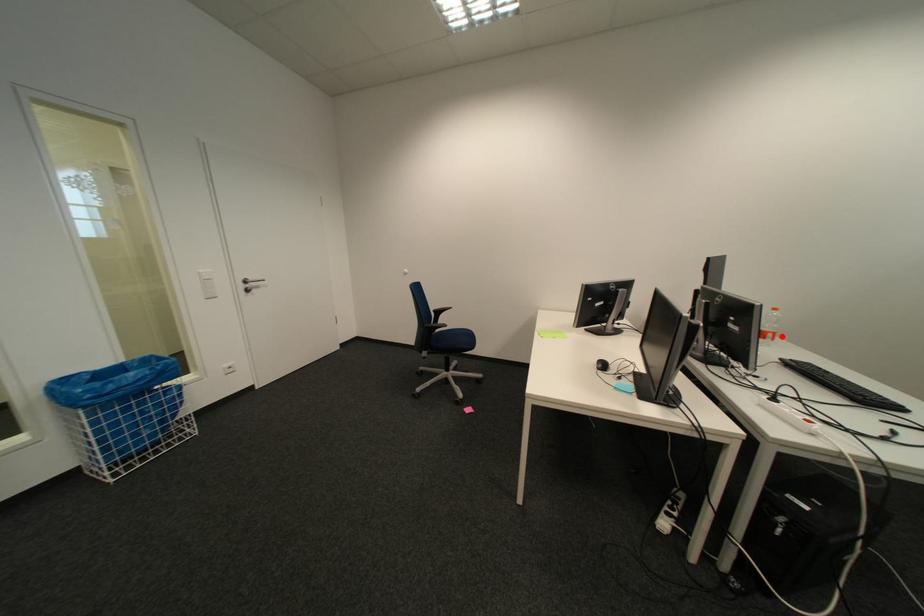
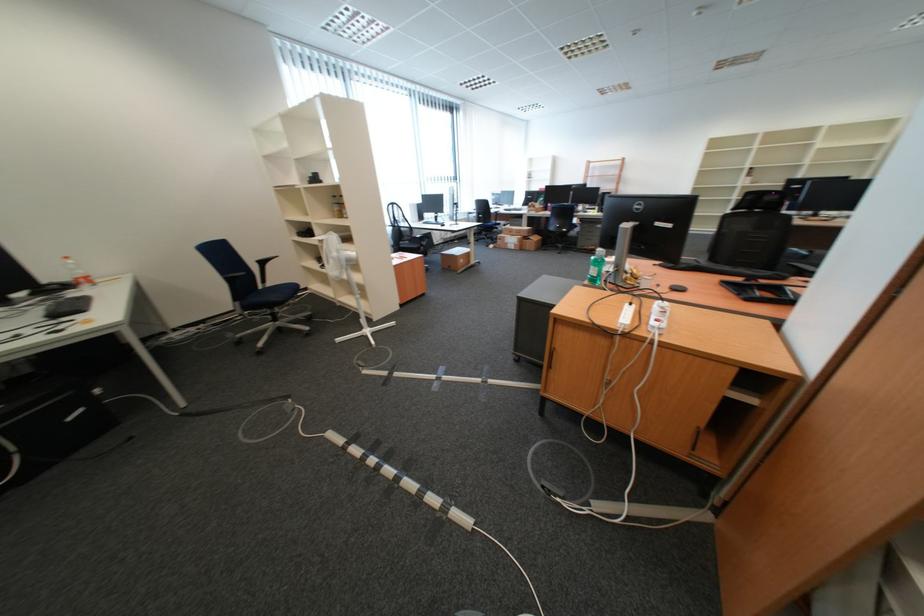
Where in the second image is the point corresponding to the highlighted location from the first image?

(93, 282)